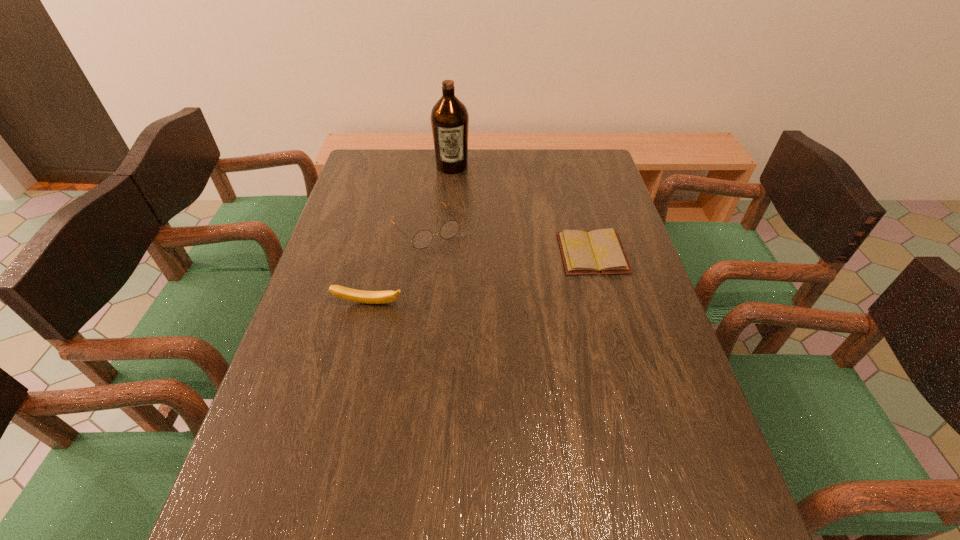
I want to click on the nearest object, so click(x=370, y=297).

This screenshot has width=960, height=540. In order to click on diary in this screenshot , I will do `click(600, 251)`.

Identify the location of the shortest object. The width and height of the screenshot is (960, 540). (600, 251).

Locate an element on the screen. olive oil is located at coordinates (449, 117).

I want to click on the tallest object, so pyautogui.click(x=449, y=117).

The height and width of the screenshot is (540, 960). Find the location of `spectacles`. spectacles is located at coordinates (422, 239).

The height and width of the screenshot is (540, 960). I want to click on vacant space located 0.050m at the stem of the nearest object, so click(x=364, y=325).

Locate an element on the screen. free space located on the back of the diary is located at coordinates (578, 198).

Locate an element on the screen. Image resolution: width=960 pixels, height=540 pixels. free location located on the label of the farthest object is located at coordinates (458, 249).

This screenshot has height=540, width=960. I want to click on free region located on the label of the farthest object, so click(x=457, y=238).